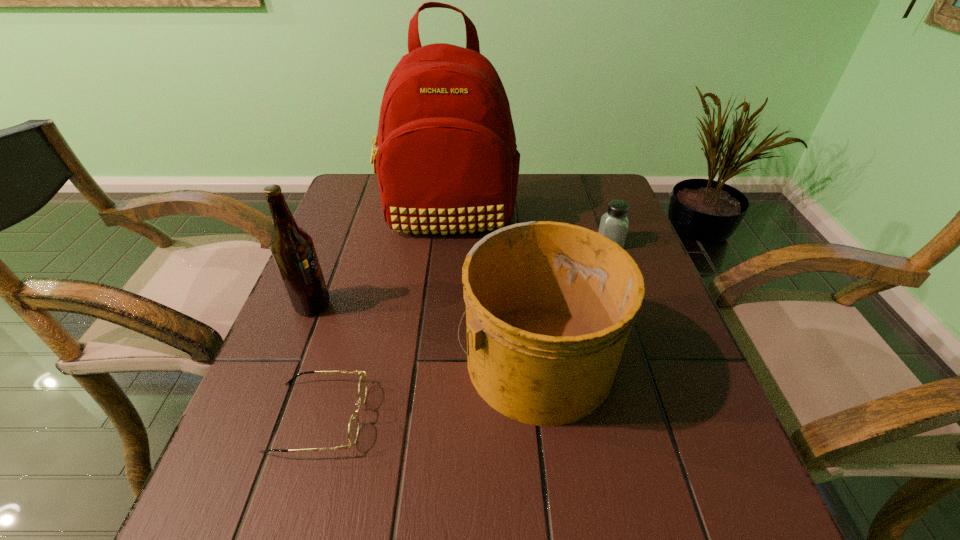
At what (x,y) coordinates should I click in order to perform the action: click on free location at the near left corner of the desktop. Please return your answer as a coordinate pair (x, y). Looking at the image, I should click on (313, 493).

Where is `free space at the far right corner of the desktop`? This screenshot has height=540, width=960. free space at the far right corner of the desktop is located at coordinates (617, 191).

In the image, there is a desktop. Find the location of `free region at the near right corner`. free region at the near right corner is located at coordinates (698, 503).

This screenshot has width=960, height=540. What are the coordinates of `vacant point located between the spectacles and the rightmost object` in the screenshot? It's located at (465, 330).

This screenshot has width=960, height=540. Find the location of `free spot between the shortest object and the saltshaker`. free spot between the shortest object and the saltshaker is located at coordinates (465, 330).

The width and height of the screenshot is (960, 540). Find the location of `unoccupied position between the rightmost object and the beer bottle`. unoccupied position between the rightmost object and the beer bottle is located at coordinates click(461, 274).

The height and width of the screenshot is (540, 960). In order to click on vacant space that is in between the tallest object and the beer bottle in this screenshot , I will do coord(380,260).

Find the location of a particular element. This screenshot has width=960, height=540. vacant region between the tallest object and the second tallest object is located at coordinates (380, 260).

Locate an element on the screen. vacant area that lies between the beer bottle and the backpack is located at coordinates (380, 260).

Where is `unoccupied position between the bucket and the spectacles`? Image resolution: width=960 pixels, height=540 pixels. unoccupied position between the bucket and the spectacles is located at coordinates (427, 387).